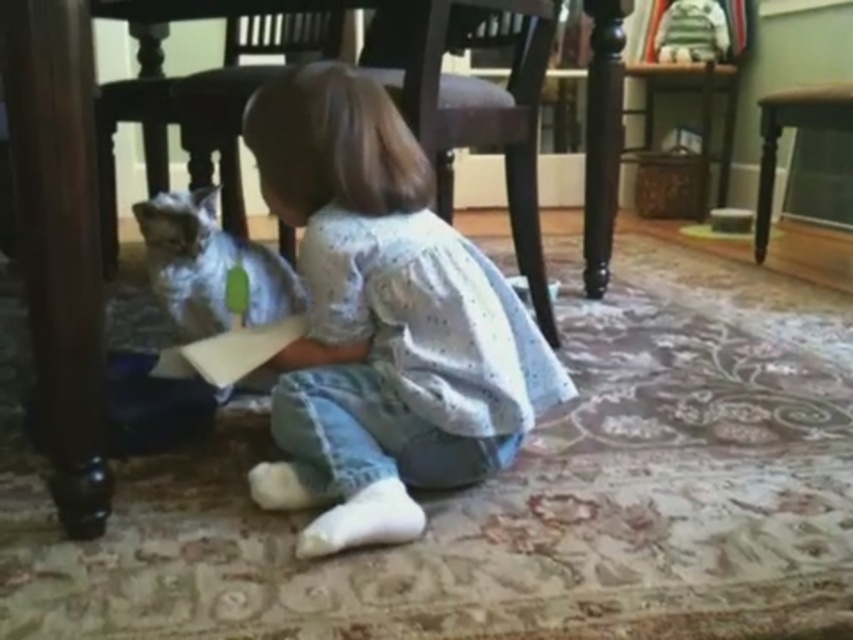
Between dark wood chair at lower center and brown wood chair at center, which one appears on the left side from the viewer's perspective?

Positioned to the left is dark wood chair at lower center.

Which is above, dark wood chair at lower center or brown wood chair at center?

Positioned higher is brown wood chair at center.

Locate an element on the screen. The height and width of the screenshot is (640, 853). dark wood chair at lower center is located at coordinates (360, 68).

The image size is (853, 640). In order to click on dark wood chair at lower center in this screenshot , I will do (x=360, y=68).

How distant is wooden chair at center from silvery fur cat at lower left?

They are 20.37 inches apart.

Between wooden chair at center and silvery fur cat at lower left, which one has less height?

silvery fur cat at lower left is shorter.

Between point (141, 28) and point (292, 282), which one is positioned in front?

Point (292, 282)

Locate an element on the screen. wooden chair at center is located at coordinates (202, 100).

Which of these two, dark wood chair at lower center or wooden stool at lower right, stands shorter?

wooden stool at lower right

Consider the image. Can you confirm if dark wood chair at lower center is bigger than wooden stool at lower right?

Correct, dark wood chair at lower center is larger in size than wooden stool at lower right.

Is point (474, 24) more distant than point (788, 100)?

No, it is not.

The image size is (853, 640). I want to click on dark wood chair at lower center, so click(x=360, y=68).